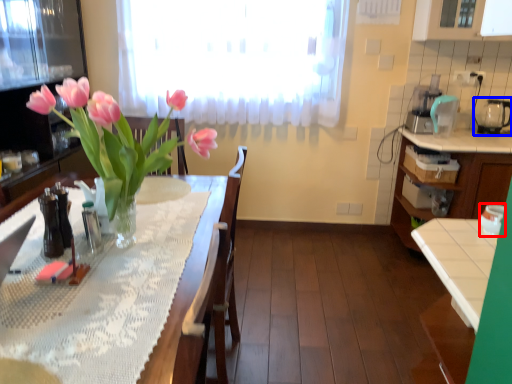
Question: Which object is further to the camera taking this photo, appliance (highlighted by a red box) or appliance (highlighted by a blue box)?

Choices:
 (A) appliance
 (B) appliance

Answer: (B)